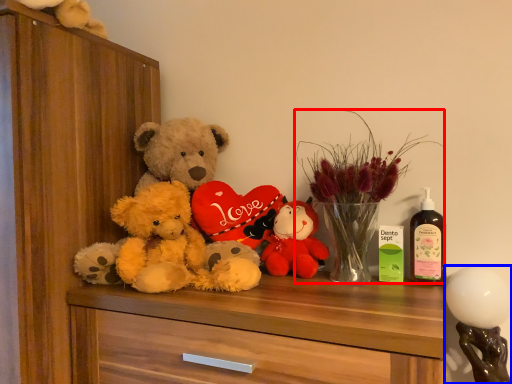
Question: Among these objects, which one is farthest to the camera, floral arrangement (highlighted by a red box) or toy (highlighted by a blue box)?

Choices:
 (A) floral arrangement
 (B) toy

Answer: (A)